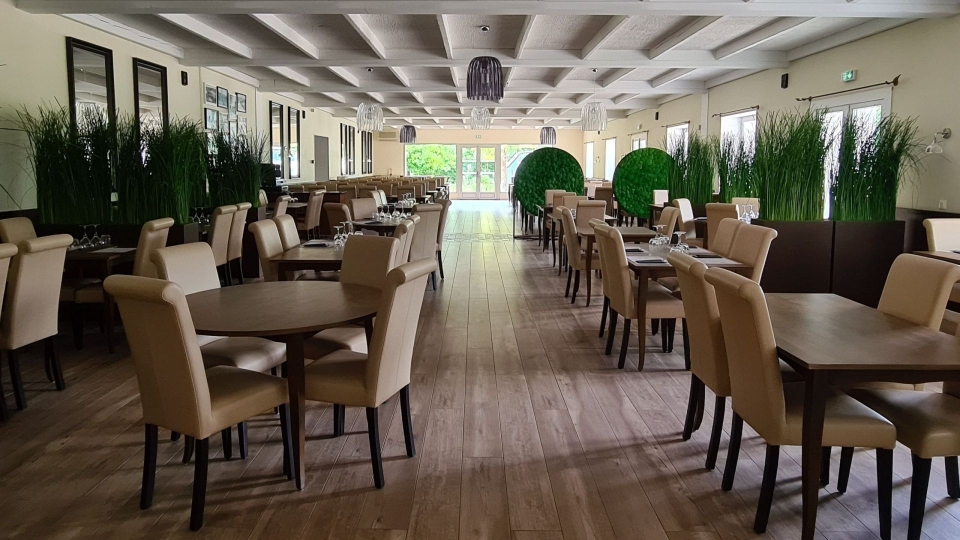
What are the coordinates of `window` in the screenshot? It's located at (588, 148), (610, 150), (636, 145), (678, 135), (752, 123), (834, 122), (869, 122), (432, 154), (514, 151).